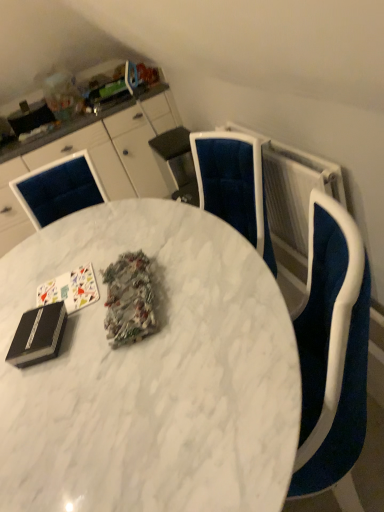
At what (x,y) coordinates should I click in order to perform the action: click on vacant space to the right of black matte binder at lower left. Please return your answer as a coordinate pair (x, y). The height and width of the screenshot is (512, 384). Looking at the image, I should click on point(83,324).